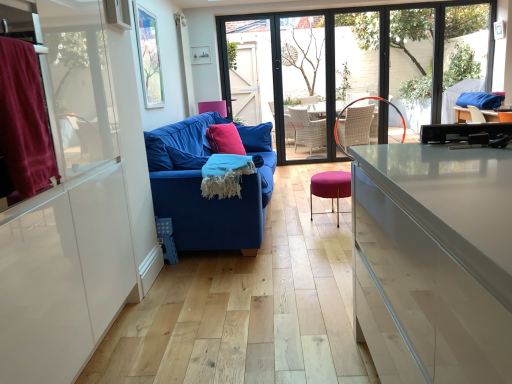
Question: Is velvet burgundy curtain at left bigger or smaller than transparent glass window screen at upper center, placed as the 1th window screen when sorted from top to bottom?

Choices:
 (A) small
 (B) big

Answer: (A)

Question: From the image's perspective, is velvet burgundy curtain at left positioned above or below transparent glass window screen at upper center, the second window screen when ordered from bottom to top?

Choices:
 (A) below
 (B) above

Answer: (A)

Question: Which of these objects is positioned farthest from the blue fabric couch at center?

Choices:
 (A) transparent glass screen door at center
 (B) velvet burgundy curtain at left
 (C) blue woven blanket at center
 (D) transparent glass door at center
 (E) transparent glass window at center

Answer: (E)

Question: Which object is positioned closest to the velvet burgundy curtain at left?

Choices:
 (A) transparent glass window at center
 (B) blue woven blanket at center
 (C) purple fabric stool at center
 (D) transparent glass door at center
 (E) transparent glass window screen at upper center, which is counted as the 2th window screen, starting from the front

Answer: (B)